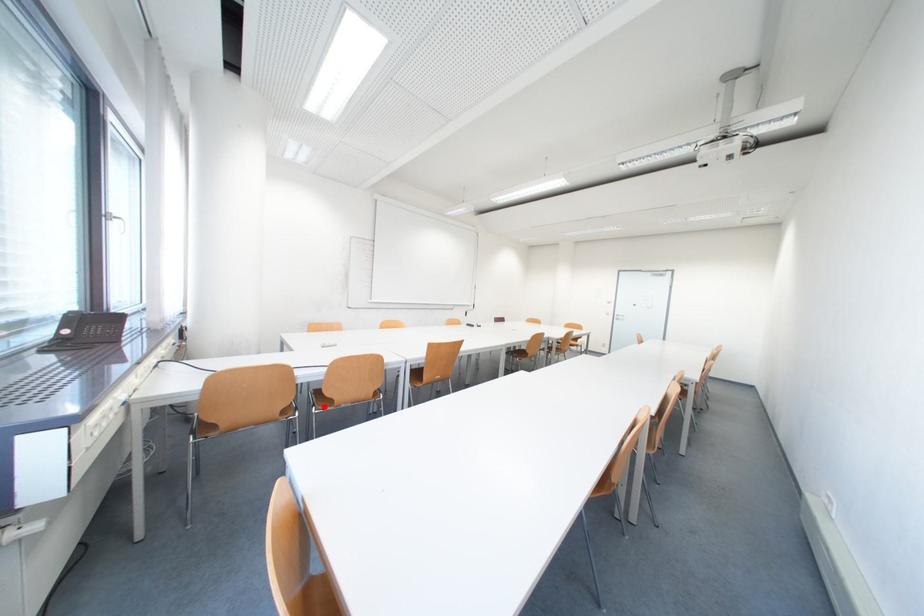
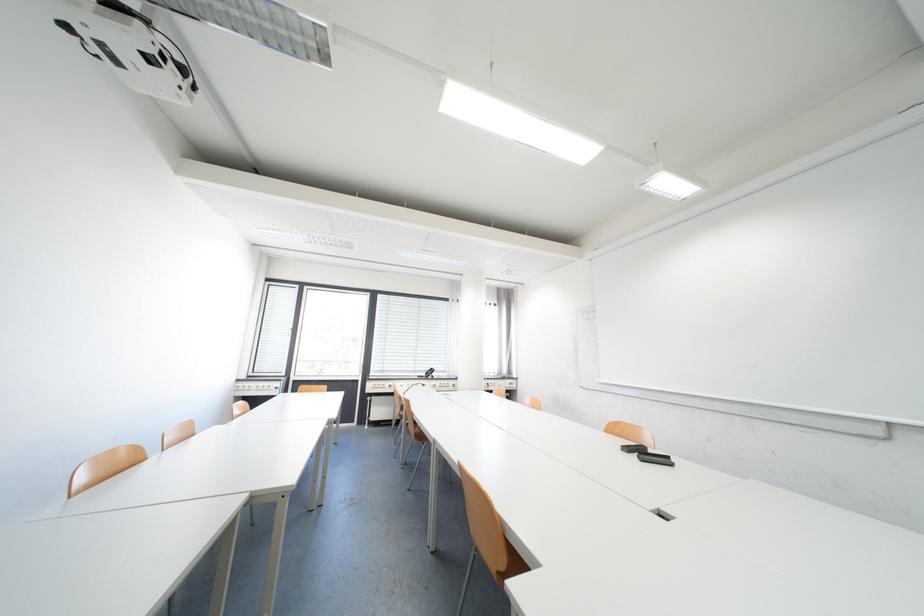
Question: I am providing you with two images of the same scene from different viewpoints. A red point is marked on the first image. Is the red point's position out of view in image 2?

Choices:
 (A) Yes
 (B) No

Answer: (A)